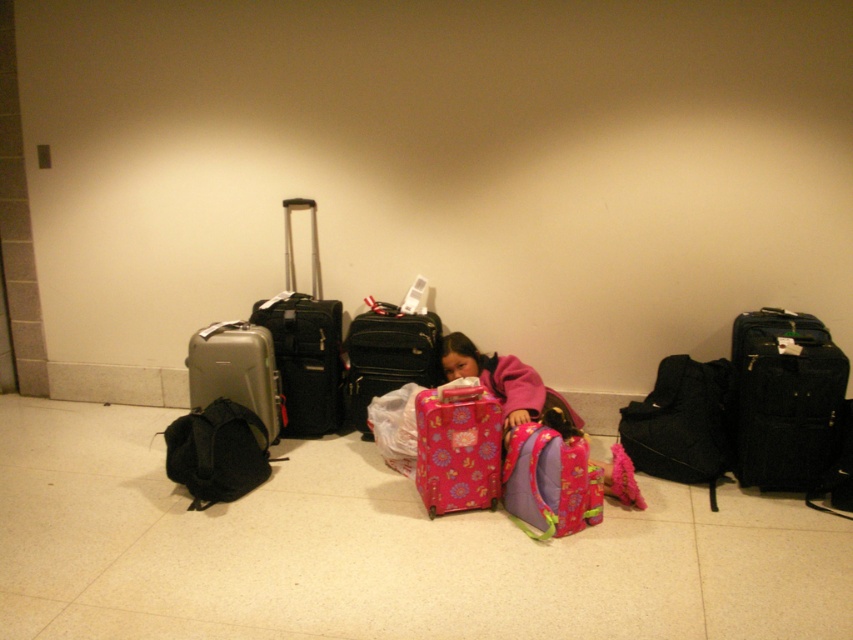
Does silver metallic suitcase at left have a lesser height compared to pink floral suitcase at center?

Incorrect, silver metallic suitcase at left's height does not fall short of pink floral suitcase at center's.

Locate an element on the screen. Image resolution: width=853 pixels, height=640 pixels. silver metallic suitcase at left is located at coordinates (305, 342).

Identify the location of silver metallic suitcase at left. (305, 342).

Is black fabric backpack at left positioned before pink floral suitcase at center?

No, it is behind pink floral suitcase at center.

Who is more forward, (206, 504) or (570, 432)?

Point (570, 432) is more forward.

Locate an element on the screen. black fabric backpack at left is located at coordinates (218, 452).

Between point (757, 403) and point (209, 404), which one is positioned in front?

Point (757, 403)

Between black fabric suitcase at right and black fabric backpack at left, which one is positioned higher?

black fabric suitcase at right is above.

Which is in front, point (743, 429) or point (213, 481)?

Point (213, 481)

At what (x,y) coordinates should I click in order to perform the action: click on black fabric suitcase at right. Please return your answer as a coordinate pair (x, y). The image size is (853, 640). Looking at the image, I should click on (784, 397).